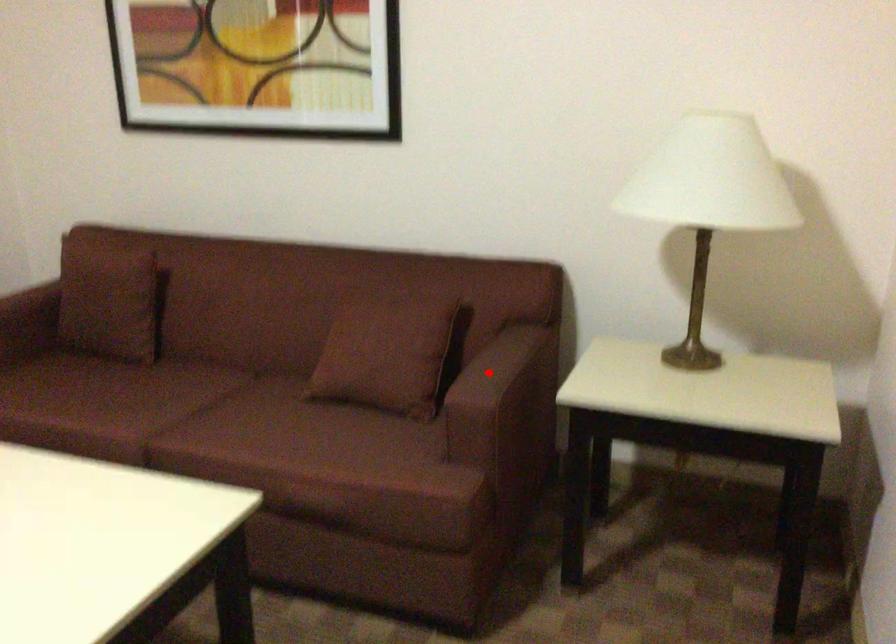
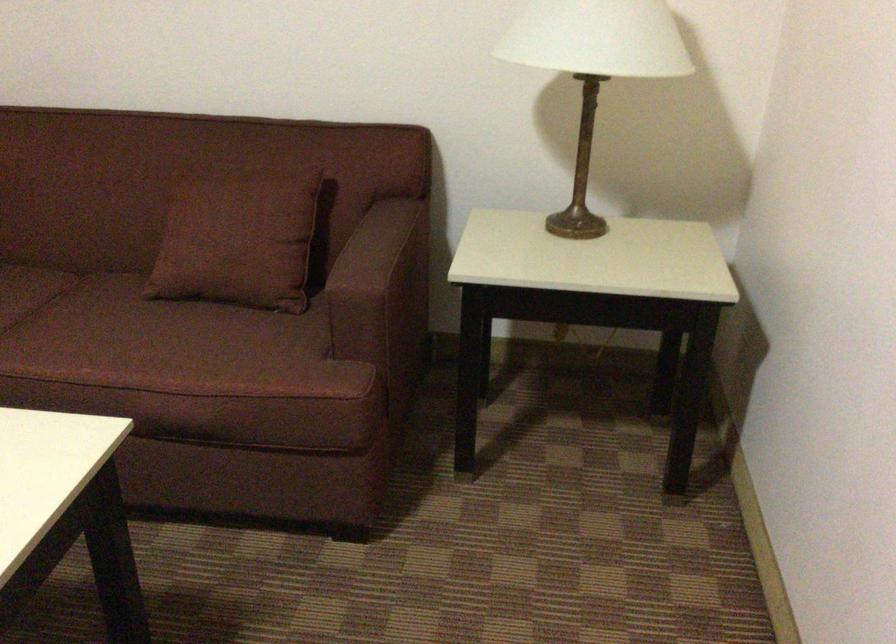
Where in the second image is the point corresponding to the highlighted location from the first image?

(367, 254)